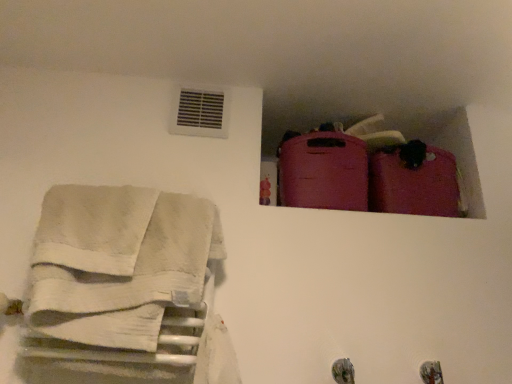
Question: Is matte pink suitcase at upper right, the second luggage in the left-to-right sequence, not inside white cotton towels at left?

Choices:
 (A) no
 (B) yes

Answer: (B)

Question: Can you see matte pink suitcase at upper right, marked as the 1th luggage in a right-to-left arrangement, touching white cotton towels at left?

Choices:
 (A) yes
 (B) no

Answer: (B)

Question: Does matte pink suitcase at upper right, the second luggage in the left-to-right sequence, appear on the right side of white cotton towels at left?

Choices:
 (A) yes
 (B) no

Answer: (A)

Question: Does matte pink suitcase at upper right, marked as the 1th luggage in a right-to-left arrangement, have a larger size compared to white cotton towels at left?

Choices:
 (A) no
 (B) yes

Answer: (A)

Question: Does matte pink suitcase at upper right, the second luggage in the left-to-right sequence, lie behind white cotton towels at left?

Choices:
 (A) yes
 (B) no

Answer: (A)

Question: Considering the relative sizes of matte pink suitcase at upper right, the second luggage in the left-to-right sequence, and white cotton towels at left in the image provided, is matte pink suitcase at upper right, the second luggage in the left-to-right sequence, thinner than white cotton towels at left?

Choices:
 (A) no
 (B) yes

Answer: (A)

Question: Can you confirm if matte pink suitcase at upper right, the 1th luggage in the left-to-right sequence, is taller than white cotton towels at left?

Choices:
 (A) yes
 (B) no

Answer: (B)

Question: Can you confirm if matte pink suitcase at upper right, the 1th luggage in the left-to-right sequence, is bigger than white cotton towels at left?

Choices:
 (A) yes
 (B) no

Answer: (B)

Question: Is matte pink suitcase at upper right, the 1th luggage in the left-to-right sequence, looking in the opposite direction of white cotton towels at left?

Choices:
 (A) yes
 (B) no

Answer: (B)

Question: From a real-world perspective, is matte pink suitcase at upper right, the 1th luggage in the left-to-right sequence, on top of white cotton towels at left?

Choices:
 (A) no
 (B) yes

Answer: (B)

Question: Is matte pink suitcase at upper right, the 1th luggage in the left-to-right sequence, to the right of white cotton towels at left from the viewer's perspective?

Choices:
 (A) no
 (B) yes

Answer: (B)

Question: Is matte pink suitcase at upper right, which is the second luggage in right-to-left order, beside white cotton towels at left?

Choices:
 (A) no
 (B) yes

Answer: (A)

Question: Does matte pink suitcase at upper right, the second luggage in the left-to-right sequence, have a greater width compared to matte pink suitcase at upper right, which is the second luggage in right-to-left order?

Choices:
 (A) no
 (B) yes

Answer: (A)